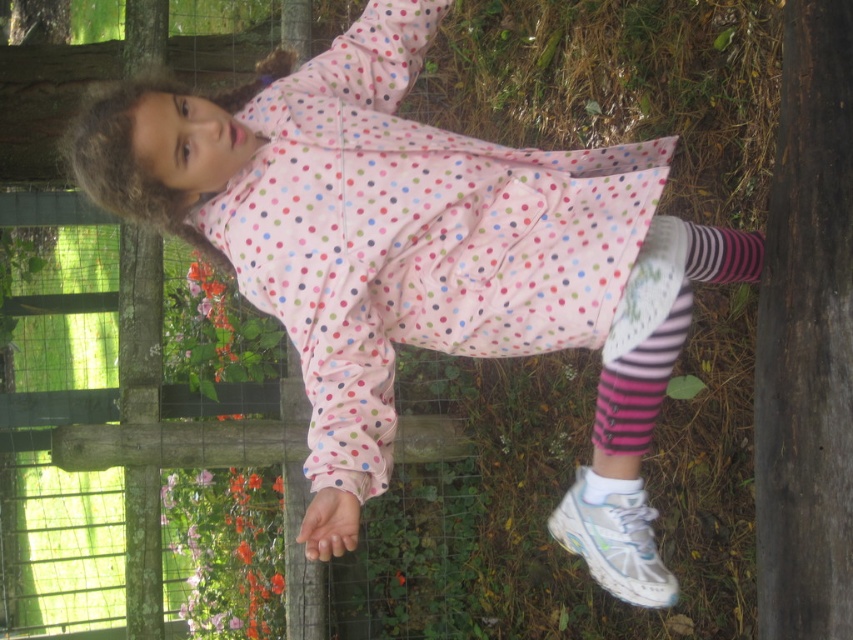
Find the location of a particular element. white mesh shoe at lower right is located at coordinates (614, 544).

Who is positioned more to the left, white mesh shoe at lower right or white smooth sock at lower center?

white smooth sock at lower center

Is point (634, 563) positioned before point (583, 474)?

Yes, it is.

This screenshot has width=853, height=640. In order to click on white mesh shoe at lower right in this screenshot , I will do `click(614, 544)`.